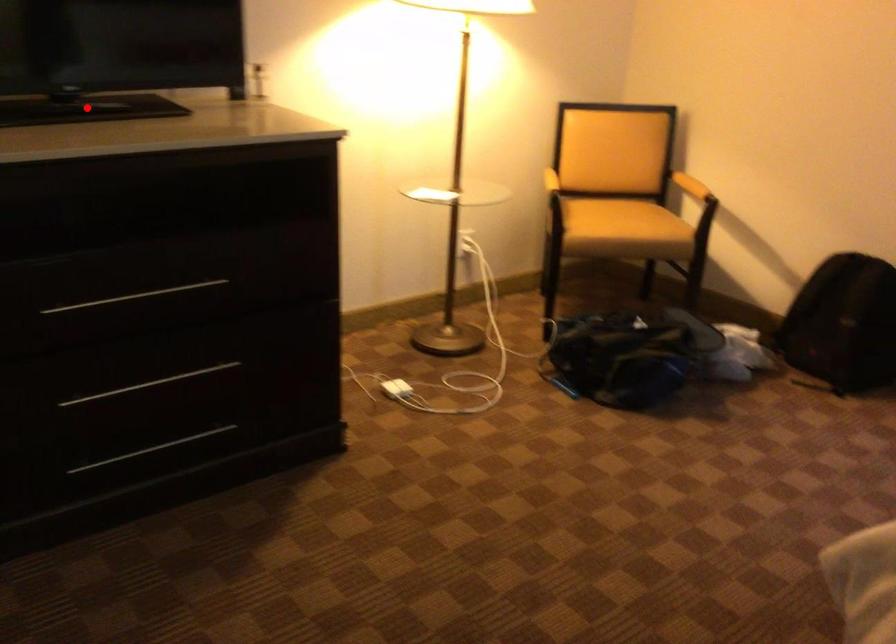
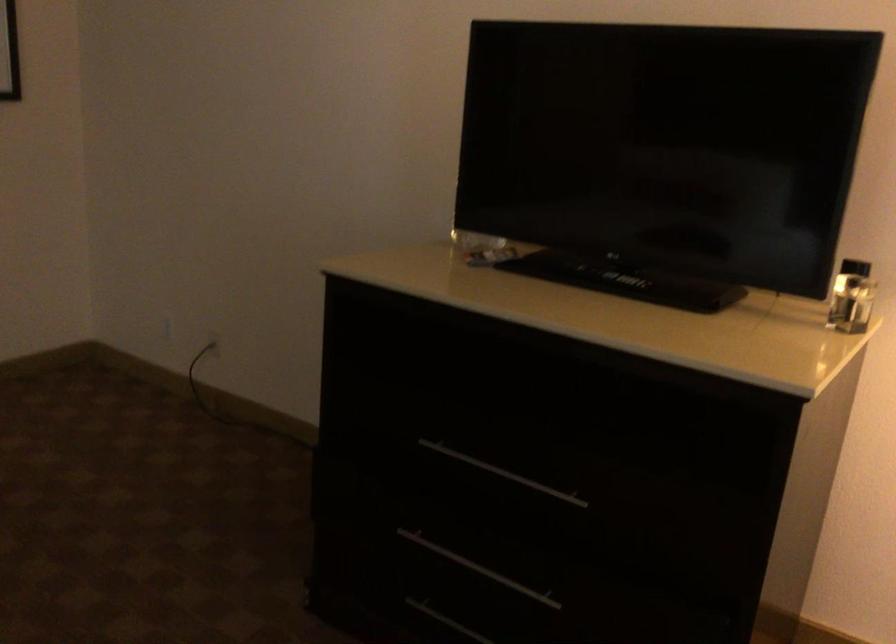
In the second image, find the point that corresponds to the highlighted location in the first image.

(625, 279)